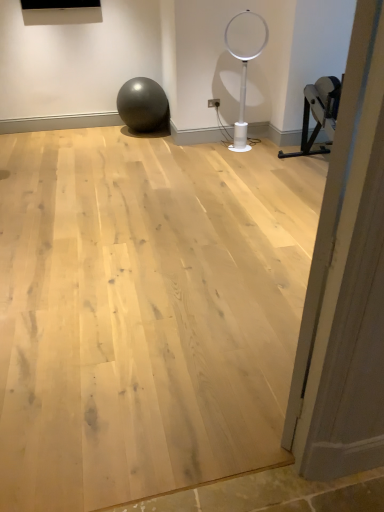
The height and width of the screenshot is (512, 384). I want to click on vacant space underneath white plastic basketball hoop at center (from a real-world perspective), so click(255, 144).